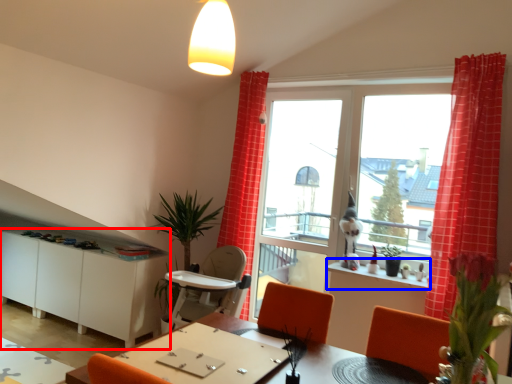
Question: Which object is further to the camera taking this photo, cabinetry (highlighted by a red box) or window sill (highlighted by a blue box)?

Choices:
 (A) cabinetry
 (B) window sill

Answer: (A)